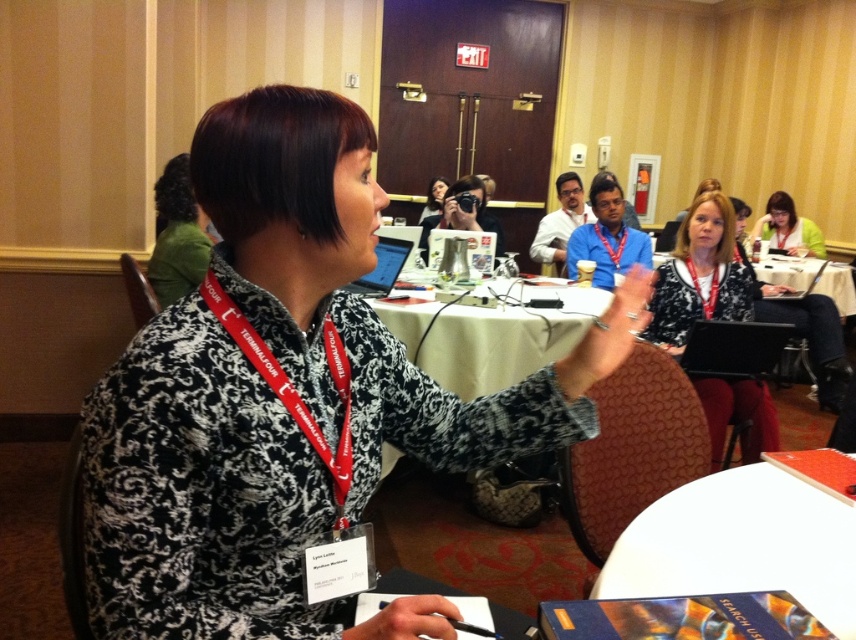
Question: Which point is farther from the camera taking this photo?

Choices:
 (A) (283, 378)
 (B) (710, 378)

Answer: (B)

Question: Can you confirm if white paper at lower right is positioned below green fabric shirt at upper right?

Choices:
 (A) yes
 (B) no

Answer: (A)

Question: Which object appears closest to the camera in this image?

Choices:
 (A) red fabric lanyard at center
 (B) green fabric shirt at upper right

Answer: (A)

Question: Is white paper at lower right smaller than matte black jacket at center?

Choices:
 (A) yes
 (B) no

Answer: (A)

Question: Estimate the real-world distances between objects in this image. Which object is farther from the white paper at lower right?

Choices:
 (A) matte black laptop at upper center
 (B) green fabric shirt at upper right

Answer: (B)

Question: Does white paper at lower right have a greater width compared to white fabric table at center?

Choices:
 (A) no
 (B) yes

Answer: (A)